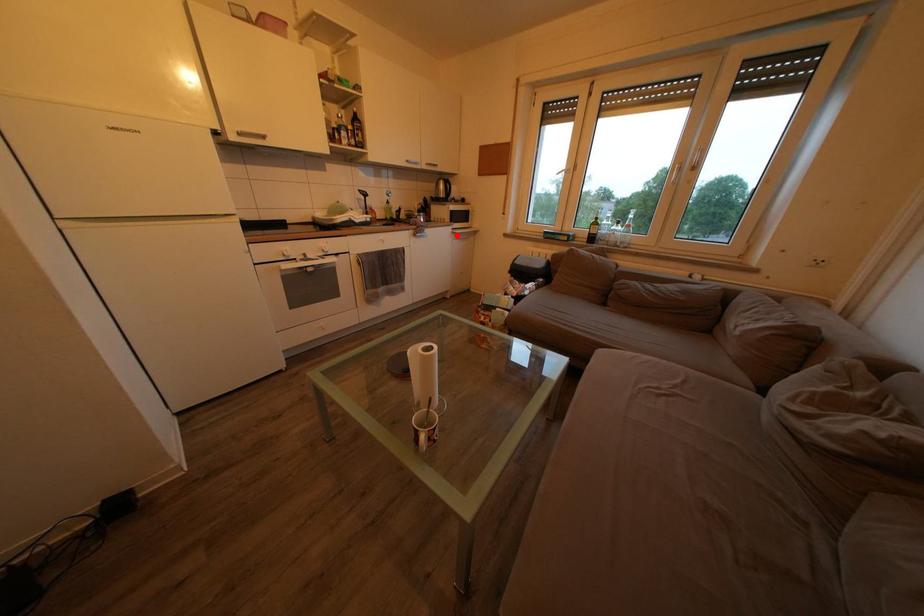
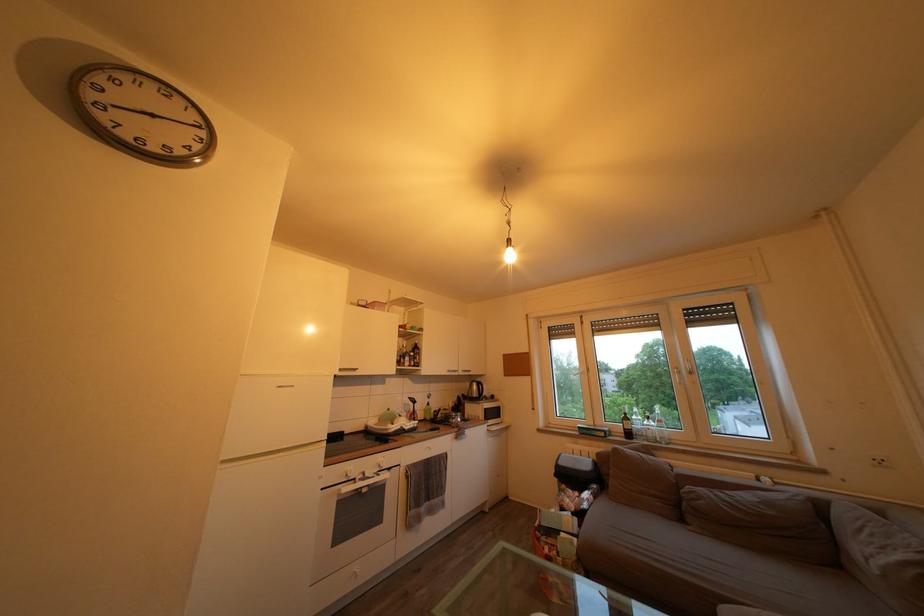
Question: I am providing you with two images of the same scene from different viewpoints. In image1, a red point is highlighted. Considering the same 3D point in image2, which of the following is correct?

Choices:
 (A) It is closer
 (B) It is farther

Answer: (B)